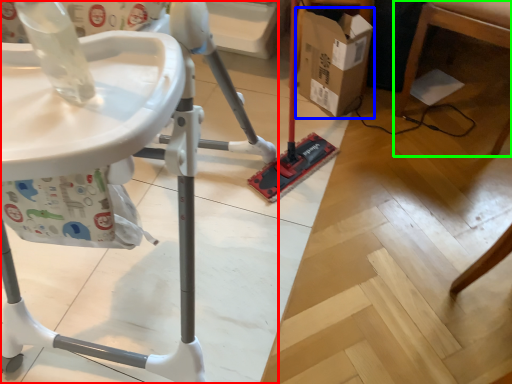
Question: Which object is positioned closest to furniture (highlighted by a red box)? Select from cardboard box (highlighted by a blue box) and furniture (highlighted by a green box).

Choices:
 (A) cardboard box
 (B) furniture

Answer: (A)